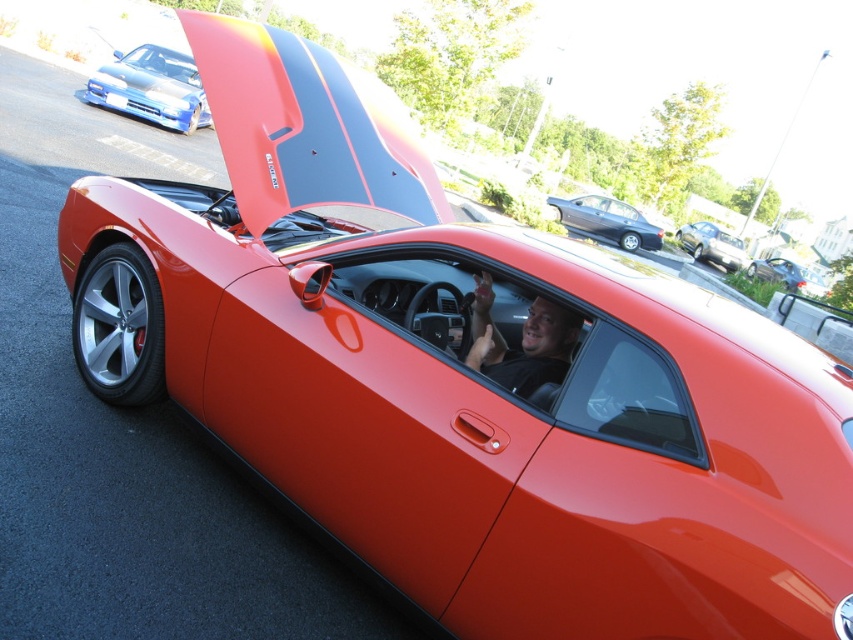
Is shiny metallic hood at upper center smaller than satin black sedan at center?

Indeed, shiny metallic hood at upper center has a smaller size compared to satin black sedan at center.

Is shiny metallic hood at upper center to the left of satin black sedan at center from the viewer's perspective?

Indeed, shiny metallic hood at upper center is positioned on the left side of satin black sedan at center.

Does point (253, 211) come in front of point (697, 234)?

Yes, point (253, 211) is in front of point (697, 234).

At what (x,y) coordinates should I click in order to perform the action: click on shiny metallic hood at upper center. Please return your answer as a coordinate pair (x, y). The width and height of the screenshot is (853, 640). Looking at the image, I should click on (306, 125).

Between point (572, 320) and point (807, 291), which one is positioned behind?

The point (807, 291) is more distant.

Which is more to the right, matte black shirt at center or glossy metallic car at center?

glossy metallic car at center is more to the right.

Who is more distant from viewer, (537, 360) or (809, 284)?

The point (809, 284) is more distant.

What are the coordinates of `matte black shirt at center` in the screenshot? It's located at (521, 342).

Is blue glossy sports car at upper left below matte black shirt at center?

Actually, blue glossy sports car at upper left is above matte black shirt at center.

Can you confirm if blue glossy sports car at upper left is wider than matte black shirt at center?

Yes, blue glossy sports car at upper left is wider than matte black shirt at center.

Which is in front, point (119, 51) or point (479, 304)?

Point (479, 304) is more forward.

Locate an element on the screen. blue glossy sports car at upper left is located at coordinates (152, 88).